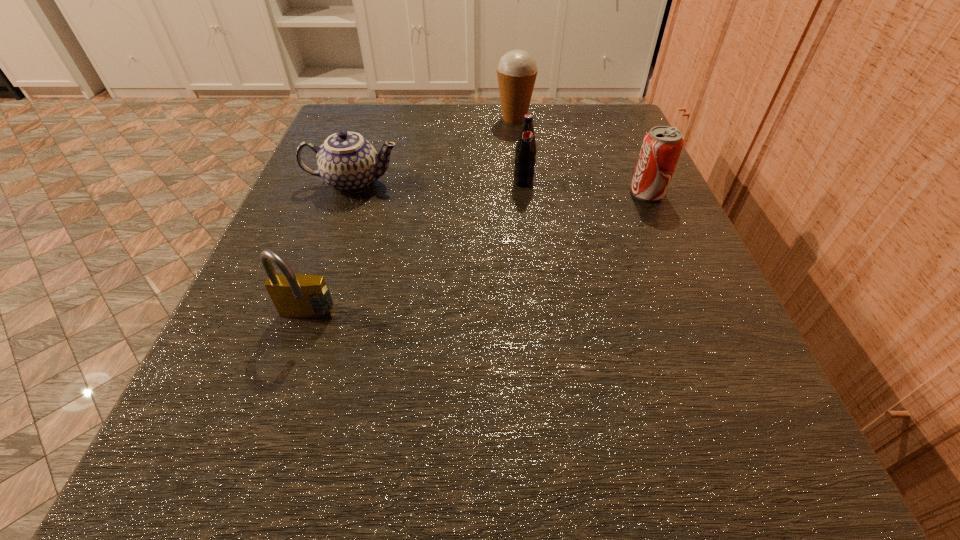
You are a GUI agent. You are given a task and a screenshot of the screen. Output one action in this format:
    pyautogui.click(x=<x>, y=<y>)
    Task: Click on the object that is at the far edge
    The width and height of the screenshot is (960, 540).
    Given the screenshot: What is the action you would take?
    pyautogui.click(x=517, y=70)

This screenshot has height=540, width=960. I want to click on padlock positioned at the left edge, so click(302, 296).

Where is `chinaware located in the left edge section of the desktop`? The height and width of the screenshot is (540, 960). chinaware located in the left edge section of the desktop is located at coordinates (347, 162).

The height and width of the screenshot is (540, 960). I want to click on object that is at the right edge, so (x=661, y=148).

In the image, there is a desktop. Where is `blank space at the far edge`? This screenshot has height=540, width=960. blank space at the far edge is located at coordinates (461, 162).

Identify the location of vacant space at the near edge of the desktop. (523, 508).

Locate an element on the screen. This screenshot has width=960, height=540. free space at the left edge of the desktop is located at coordinates (352, 259).

In the image, there is a desktop. At what (x,y) coordinates should I click in order to perform the action: click on vacant space at the right edge. Please return your answer as a coordinate pair (x, y). Looking at the image, I should click on (722, 323).

Locate an element on the screen. Image resolution: width=960 pixels, height=540 pixels. free space at the far right corner of the desktop is located at coordinates (589, 161).

Identify the location of free spot at the near right corner of the desktop. coord(833,516).